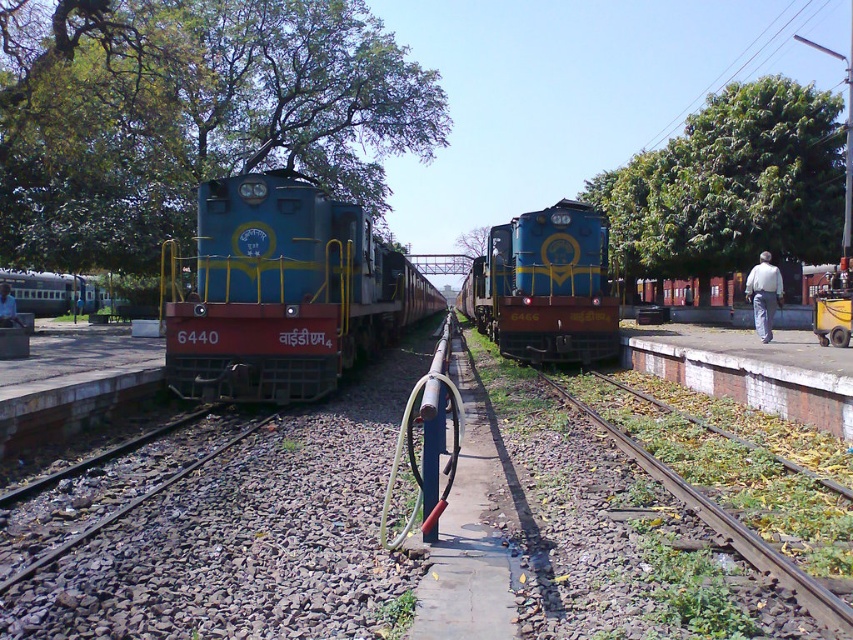
Is blue glossy locomotive at center positioned in front of green matte train at left?

Yes, blue glossy locomotive at center is in front of green matte train at left.

Measure the distance between blue glossy locomotive at center and green matte train at left.

The distance of blue glossy locomotive at center from green matte train at left is 104.04 feet.

Between point (527, 292) and point (22, 305), which one is positioned in front?

Point (527, 292) is more forward.

Locate an element on the screen. blue glossy locomotive at center is located at coordinates (544, 285).

Does matte blue train at center have a greater width compared to green matte train at left?

Incorrect, matte blue train at center's width does not surpass green matte train at left's.

Does point (256, 301) come behind point (80, 276)?

That is False.

Which is behind, point (303, 246) or point (53, 307)?

The point (53, 307) is behind.

Locate an element on the screen. This screenshot has width=853, height=640. matte blue train at center is located at coordinates (283, 292).

Is matte blue train at center wider than green grassy track at lower right?

Yes, matte blue train at center is wider than green grassy track at lower right.

Who is higher up, matte blue train at center or green grassy track at lower right?

Positioned higher is matte blue train at center.

Does point (357, 253) come closer to viewer compared to point (775, 561)?

No.

Find the location of a particular element. The image size is (853, 640). matte blue train at center is located at coordinates [283, 292].